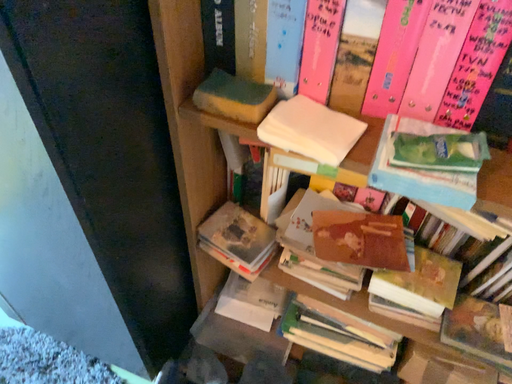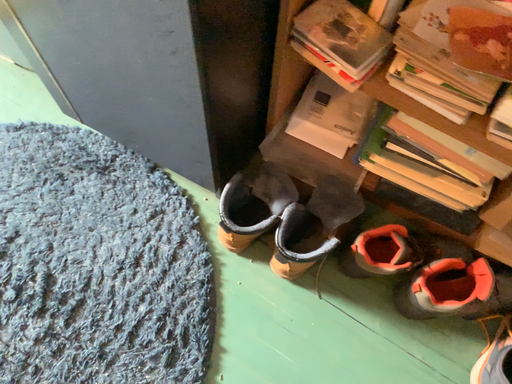
Question: Which way did the camera rotate in the video?

Choices:
 (A) rotated upward
 (B) rotated downward

Answer: (B)